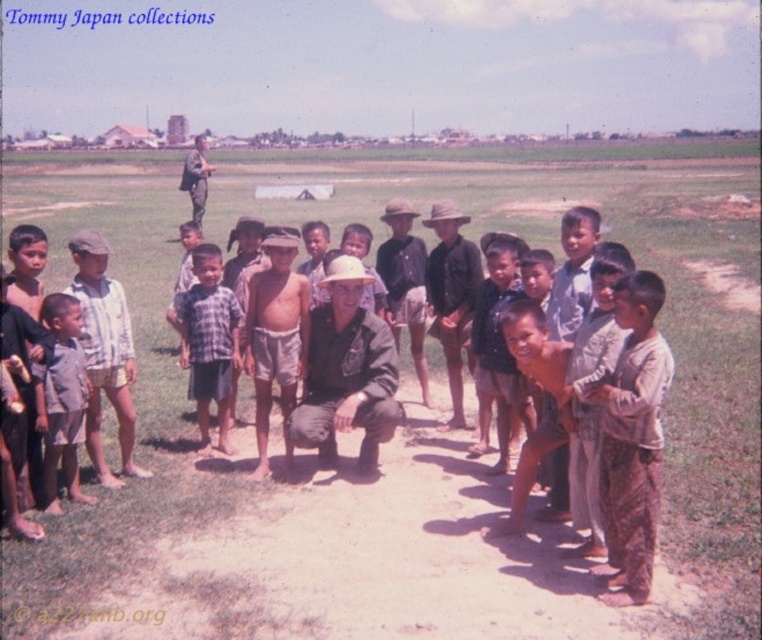
You are a photographer trying to capture a group photo of the brown woven pants at lower right and the light brown cotton shirt at center. Given that your camera has a maximum focus range of 3 meters, will you be able to capture both subjects in focus without moving the camera?

The brown woven pants at lower right and the light brown cotton shirt at center are 3.50 meters apart. Since the camera can only focus up to 3 meters, the distance between them exceeds the camera range. Therefore, you cannot capture both in focus without moving the camera.

You are standing in a rural setting with an adult in a military uniform and children around them. You notice a point at coordinates (207, 342). Based on the scene description, can you determine what object this point is located on?

The point at coordinates (207, 342) is located on the checkered fabric shirt at center.

You are standing at the camera position and want to hand a small gift to the adult in the scene. The adult is wearing a military uniform and a wide brimmed hat. The gift is too small to be seen in the image. You have a remote control that can launch the gift up to 5 meters. Will the remote control be able to reach the brown woven pants at lower right?

The brown woven pants at lower right is 4.81 meters from camera. Since the remote control can launch the gift up to 5 meters, it will be able to reach the brown woven pants at lower right.